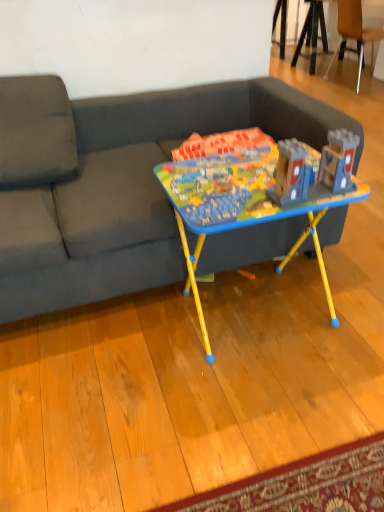
Find the location of a particular element. The image size is (384, 512). empty space that is ontop of matte plastic table at center (from a real-world perspective) is located at coordinates (235, 177).